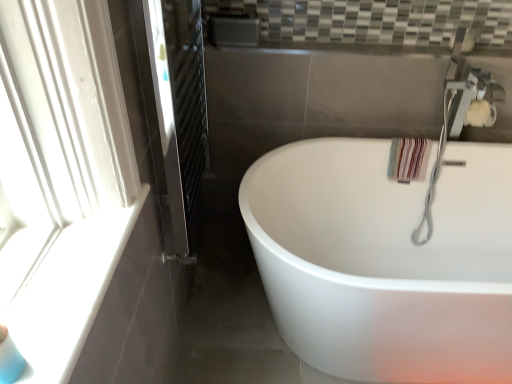
Question: Is silver metallic faucet at upper right positioned beyond the bounds of white glossy bathtub at center?

Choices:
 (A) yes
 (B) no

Answer: (B)

Question: Can you confirm if silver metallic faucet at upper right is thinner than white glossy bathtub at center?

Choices:
 (A) yes
 (B) no

Answer: (A)

Question: Does silver metallic faucet at upper right have a lesser height compared to white glossy bathtub at center?

Choices:
 (A) yes
 (B) no

Answer: (B)

Question: Is silver metallic faucet at upper right far from white glossy bathtub at center?

Choices:
 (A) no
 (B) yes

Answer: (A)

Question: Considering the relative positions of silver metallic faucet at upper right and white glossy bathtub at center in the image provided, is silver metallic faucet at upper right to the right of white glossy bathtub at center from the viewer's perspective?

Choices:
 (A) yes
 (B) no

Answer: (A)

Question: Is silver metallic faucet at upper right facing towards white glossy bathtub at center?

Choices:
 (A) no
 (B) yes

Answer: (B)

Question: Is there a large distance between white glossy bathtub at center and silver metallic faucet at upper right?

Choices:
 (A) yes
 (B) no

Answer: (B)

Question: Can you confirm if white glossy bathtub at center is smaller than silver metallic faucet at upper right?

Choices:
 (A) no
 (B) yes

Answer: (A)

Question: Does white glossy bathtub at center have a lesser height compared to silver metallic faucet at upper right?

Choices:
 (A) no
 (B) yes

Answer: (B)

Question: Is white glossy bathtub at center closer to camera compared to silver metallic faucet at upper right?

Choices:
 (A) no
 (B) yes

Answer: (B)

Question: From a real-world perspective, is white glossy bathtub at center below silver metallic faucet at upper right?

Choices:
 (A) no
 (B) yes

Answer: (B)

Question: Is white glossy bathtub at center further to camera compared to silver metallic faucet at upper right?

Choices:
 (A) no
 (B) yes

Answer: (A)

Question: Does white glossy bathtub at center lie behind clear glass screen door at left?

Choices:
 (A) yes
 (B) no

Answer: (A)